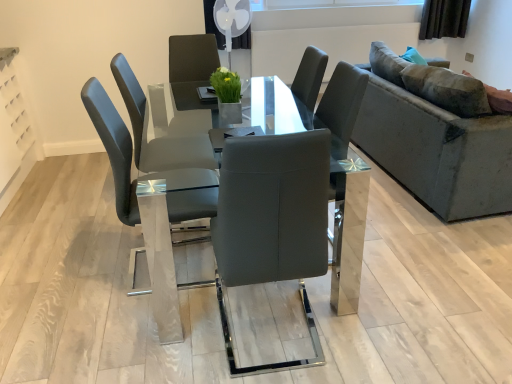
I want to click on free location to the left of transparent glass table at center, so click(67, 245).